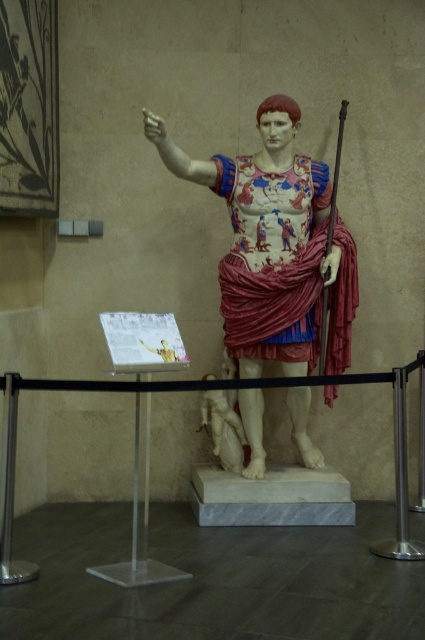
Which is above, marble statue at center or marble statue of a figure at center?

marble statue at center is above.

Who is positioned more to the left, marble statue at center or marble statue of a figure at center?

marble statue of a figure at center is more to the left.

Is point (272, 339) farther from camera compared to point (217, 426)?

That is False.

Locate an element on the screen. marble statue at center is located at coordinates (274, 244).